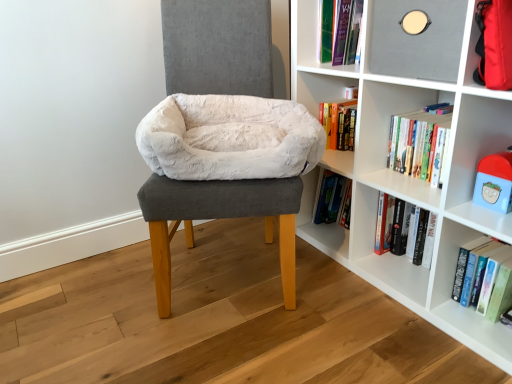
Question: Should I look upward or downward to see matte gray shelf at upper right?

Choices:
 (A) up
 (B) down

Answer: (A)

Question: Is white plush toy at upper right positioned in front of white fluffy bean bag at center?

Choices:
 (A) yes
 (B) no

Answer: (A)

Question: Can we say white plush toy at upper right lies outside white fluffy bean bag at center?

Choices:
 (A) yes
 (B) no

Answer: (A)

Question: Considering the relative sizes of white plush toy at upper right and white fluffy bean bag at center in the image provided, is white plush toy at upper right wider than white fluffy bean bag at center?

Choices:
 (A) no
 (B) yes

Answer: (A)

Question: Is white plush toy at upper right next to white fluffy bean bag at center?

Choices:
 (A) no
 (B) yes

Answer: (A)

Question: Is white fluffy bean bag at center located within white plush toy at upper right?

Choices:
 (A) yes
 (B) no

Answer: (B)

Question: From the image's perspective, does white plush toy at upper right appear lower than white fluffy bean bag at center?

Choices:
 (A) no
 (B) yes

Answer: (B)

Question: Is white matte bookshelf at center taller than white plush toy at upper right?

Choices:
 (A) yes
 (B) no

Answer: (A)

Question: Can you confirm if white matte bookshelf at center is smaller than white plush toy at upper right?

Choices:
 (A) no
 (B) yes

Answer: (A)

Question: Is white matte bookshelf at center facing away from white plush toy at upper right?

Choices:
 (A) yes
 (B) no

Answer: (A)

Question: From a real-world perspective, is white matte bookshelf at center positioned over white plush toy at upper right based on gravity?

Choices:
 (A) no
 (B) yes

Answer: (B)

Question: From the image's perspective, is white matte bookshelf at center above white plush toy at upper right?

Choices:
 (A) yes
 (B) no

Answer: (A)

Question: Can you confirm if white matte bookshelf at center is positioned to the right of white plush toy at upper right?

Choices:
 (A) no
 (B) yes

Answer: (A)

Question: Considering the relative sizes of white plush toy at upper right and white matte bookshelf at center in the image provided, is white plush toy at upper right taller than white matte bookshelf at center?

Choices:
 (A) no
 (B) yes

Answer: (A)